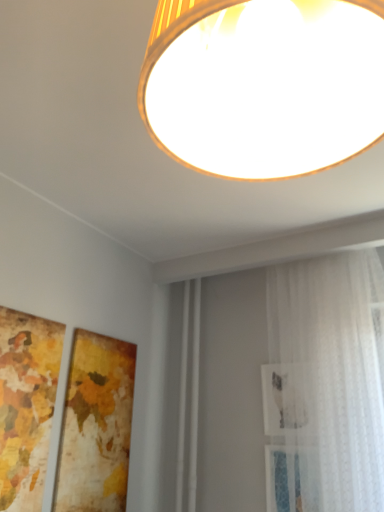
Question: Is there a large distance between wooden textured frame at lower left, the second picture frame positioned from the left, and white sheer curtain at right?

Choices:
 (A) no
 (B) yes

Answer: (A)

Question: Does wooden textured frame at lower left, the second picture frame positioned from the left, have a greater width compared to white sheer curtain at right?

Choices:
 (A) yes
 (B) no

Answer: (B)

Question: Is wooden textured frame at lower left, which ranks as the first picture frame in right-to-left order, oriented away from white sheer curtain at right?

Choices:
 (A) yes
 (B) no

Answer: (B)

Question: Considering the relative positions of wooden textured frame at lower left, the second picture frame positioned from the left, and white sheer curtain at right in the image provided, is wooden textured frame at lower left, the second picture frame positioned from the left, behind white sheer curtain at right?

Choices:
 (A) yes
 (B) no

Answer: (A)

Question: From the image's perspective, is wooden textured frame at lower left, the second picture frame positioned from the left, on white sheer curtain at right?

Choices:
 (A) no
 (B) yes

Answer: (A)

Question: From the image's perspective, is wooden textured frame at lower left, which ranks as the first picture frame in right-to-left order, above or below matte gold lampshade at upper center?

Choices:
 (A) above
 (B) below

Answer: (B)

Question: Does point coord(77,457) appear closer or farther from the camera than point coord(269,175)?

Choices:
 (A) farther
 (B) closer

Answer: (A)

Question: From a real-world perspective, relative to matte gold lampshade at upper center, is wooden textured frame at lower left, the second picture frame positioned from the left, vertically above or below?

Choices:
 (A) above
 (B) below

Answer: (B)

Question: Choose the correct answer: Is wooden textured frame at lower left, the second picture frame positioned from the left, inside matte gold lampshade at upper center or outside it?

Choices:
 (A) inside
 (B) outside

Answer: (B)

Question: Would you say matte gold lampshade at upper center is inside or outside white sheer curtain at right?

Choices:
 (A) inside
 (B) outside

Answer: (B)

Question: Looking at their shapes, would you say matte gold lampshade at upper center is wider or thinner than white sheer curtain at right?

Choices:
 (A) thin
 (B) wide

Answer: (A)

Question: Looking at the image, does matte gold lampshade at upper center seem bigger or smaller compared to white sheer curtain at right?

Choices:
 (A) big
 (B) small

Answer: (B)

Question: Visually, is matte gold lampshade at upper center positioned to the left or to the right of white sheer curtain at right?

Choices:
 (A) left
 (B) right

Answer: (A)

Question: From the image's perspective, relative to wooden map at left, the 1th picture frame viewed from the left, is wooden textured frame at lower left, which ranks as the first picture frame in right-to-left order, above or below?

Choices:
 (A) above
 (B) below

Answer: (B)

Question: Is wooden textured frame at lower left, which ranks as the first picture frame in right-to-left order, wider or thinner than wooden map at left, the 1th picture frame viewed from the left?

Choices:
 (A) thin
 (B) wide

Answer: (B)